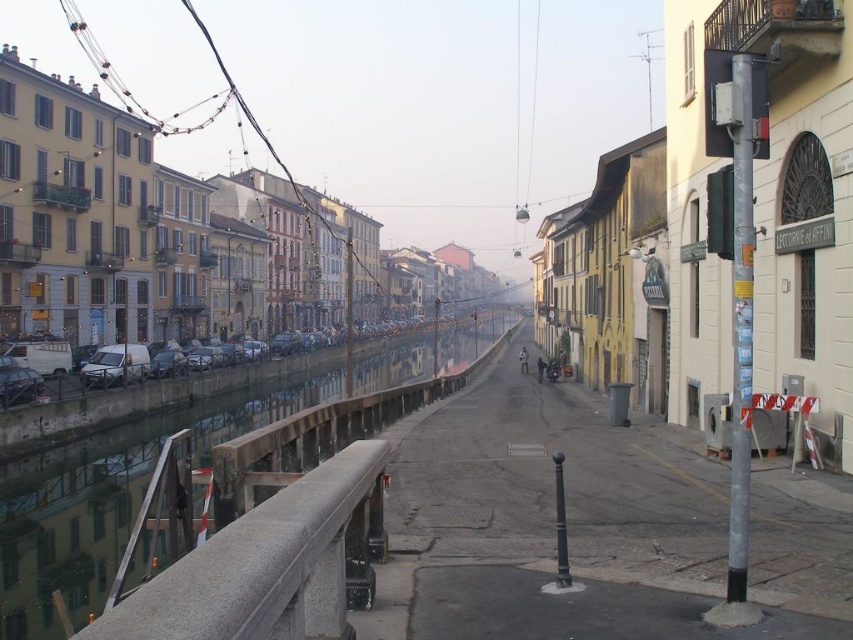
Question: Which is nearer to the silver metallic van at left?

Choices:
 (A) gray concrete rail at left
 (B) concrete water at left

Answer: (B)

Question: Is concrete water at left positioned before silver metallic van at left?

Choices:
 (A) no
 (B) yes

Answer: (B)

Question: Is gray concrete rail at left to the left of silver metallic van at left from the viewer's perspective?

Choices:
 (A) yes
 (B) no

Answer: (B)

Question: Which object is farther from the camera taking this photo?

Choices:
 (A) silver metallic van at left
 (B) concrete water at left

Answer: (A)

Question: Considering the real-world distances, which object is closest to the silver metallic van at left?

Choices:
 (A) gray concrete rail at left
 (B) concrete water at left

Answer: (B)

Question: Is concrete water at left above gray concrete rail at left?

Choices:
 (A) no
 (B) yes

Answer: (A)